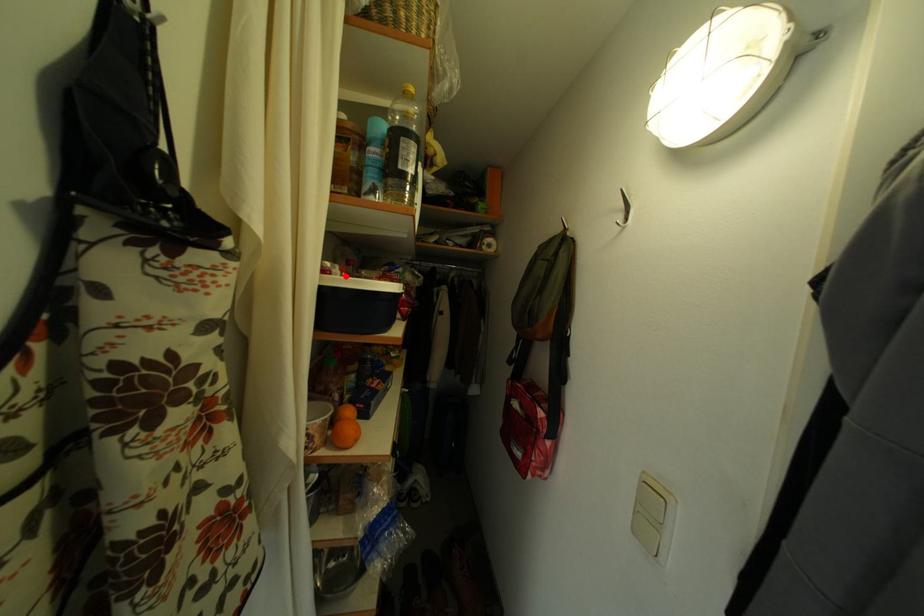
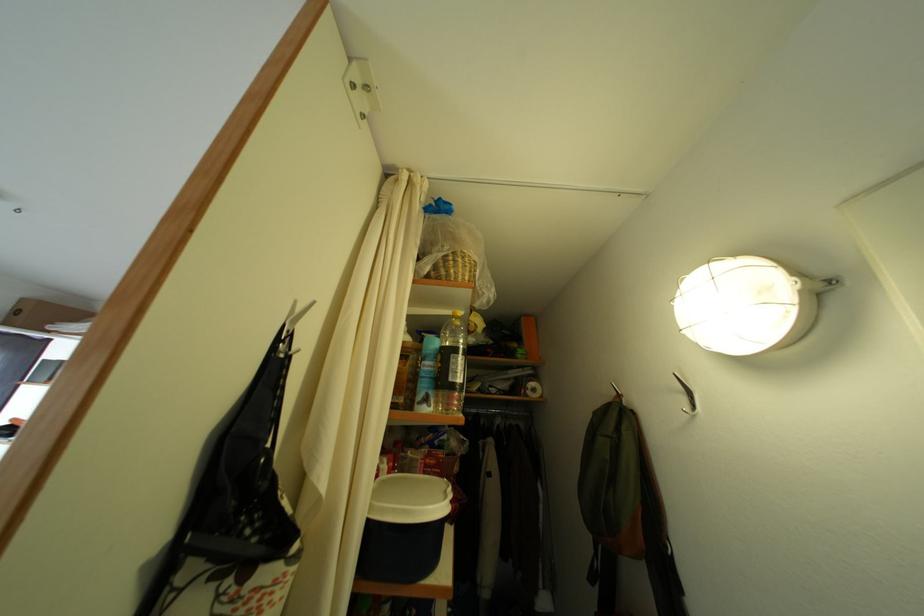
Where in the second image is the point corresponding to the highlighted location from the first image?

(394, 474)